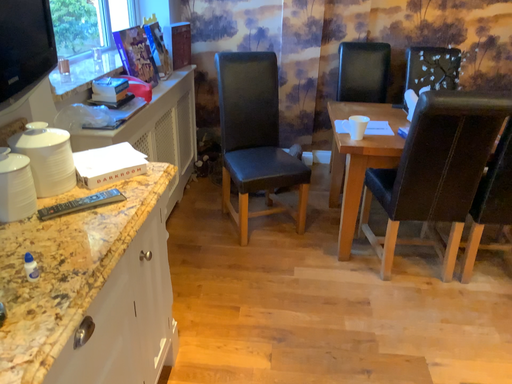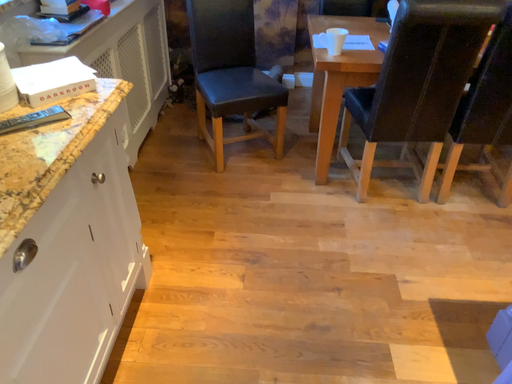
Question: How did the camera likely rotate when shooting the video?

Choices:
 (A) rotated upward
 (B) rotated downward

Answer: (B)